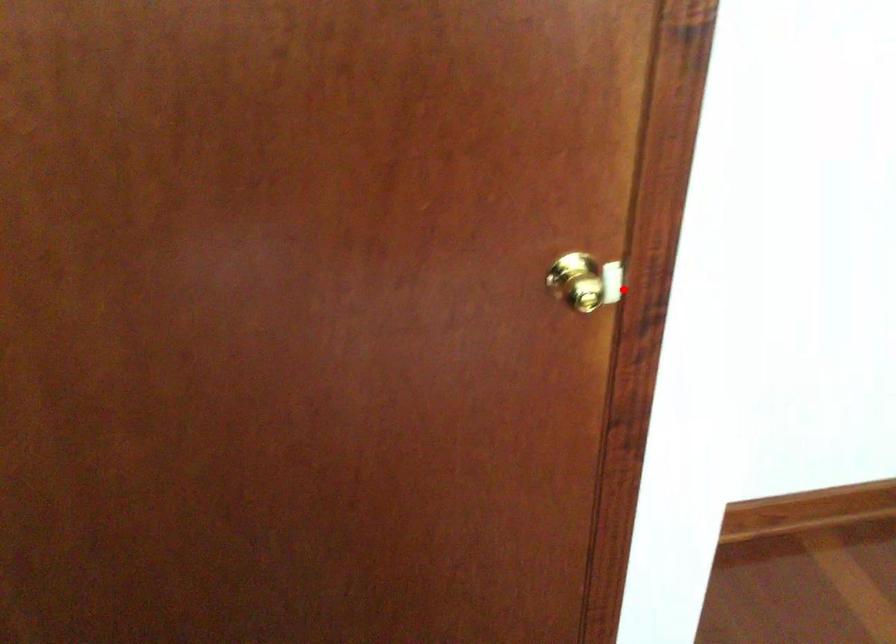
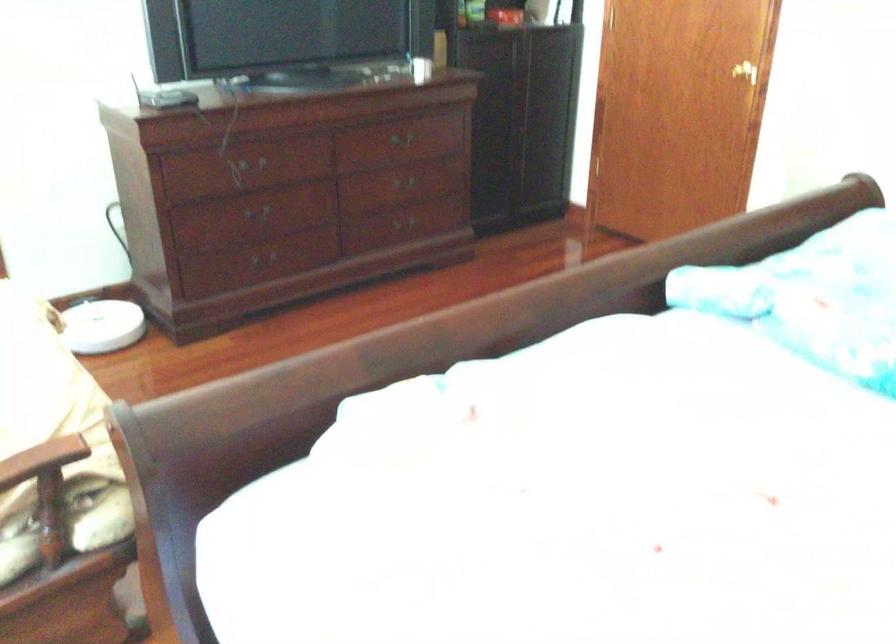
Question: I am providing you with two images of the same scene from different viewpoints. Given a red point in image1, look at the same physical point in image2. Is it:

Choices:
 (A) Closer to the viewpoint
 (B) Farther from the viewpoint

Answer: (B)